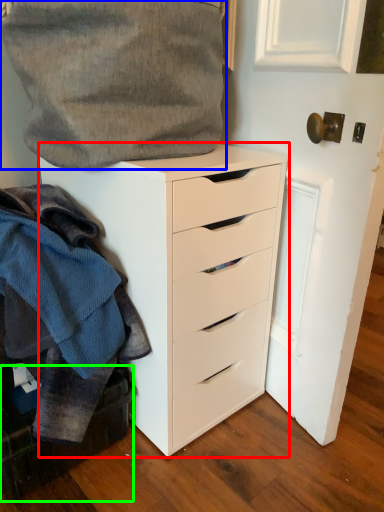
Question: Estimate the real-world distances between objects in this image. Which object is farther from chest of drawers (highlighted by a red box), gray (highlighted by a blue box) or cabinetry (highlighted by a green box)?

Choices:
 (A) gray
 (B) cabinetry

Answer: (B)